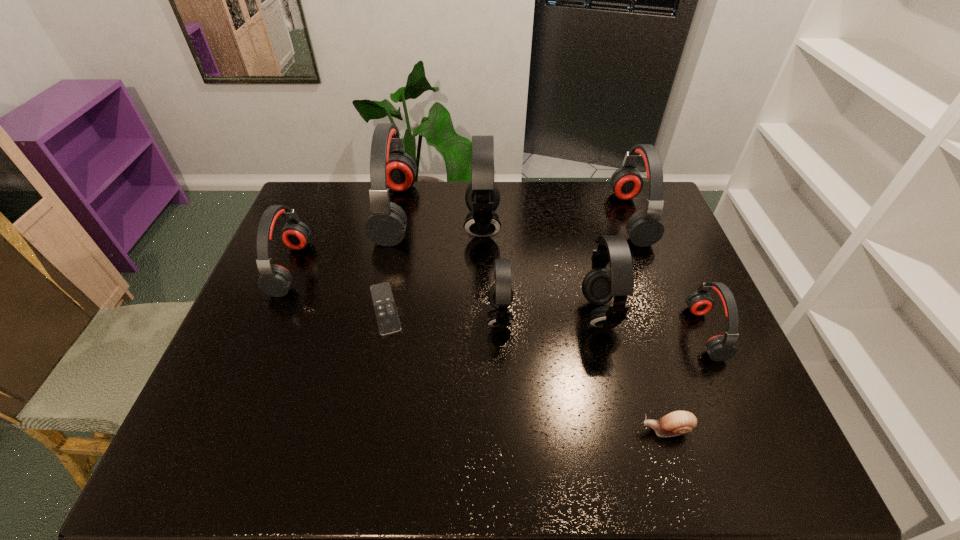
Find the location of a particular element. This screenshot has height=540, width=960. the second red earphone from left to right is located at coordinates (390, 167).

Where is `the biggest red earphone`? the biggest red earphone is located at coordinates (390, 167).

Find the location of a particular element. This screenshot has width=960, height=540. the farthest black earphone is located at coordinates (482, 197).

What are the coordinates of `the second biggest red earphone` in the screenshot? It's located at (645, 228).

Find the location of a particular element. the rightmost black earphone is located at coordinates (599, 286).

At what (x,y) coordinates should I click in order to perform the action: click on the second biggest black earphone. Please return your answer as a coordinate pair (x, y). This screenshot has height=540, width=960. Looking at the image, I should click on (599, 286).

I want to click on the leftmost object, so click(x=275, y=280).

Find the location of a particular element. Image resolution: width=960 pixels, height=540 pixels. the second smallest red earphone is located at coordinates (275, 280).

At what (x,y) coordinates should I click in order to perform the action: click on the smallest black earphone. Please return your answer as a coordinate pair (x, y). The width and height of the screenshot is (960, 540). Looking at the image, I should click on (500, 295).

Locate an element on the screen. Image resolution: width=960 pixels, height=540 pixels. the nearest red earphone is located at coordinates (720, 347).